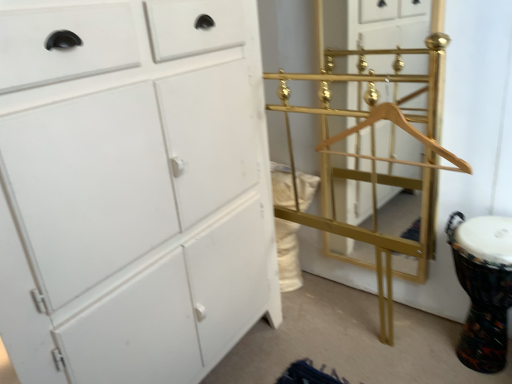
Locate an element on the screen. empty space that is ontop of multicolored fabric drum at lower right is located at coordinates (496, 226).